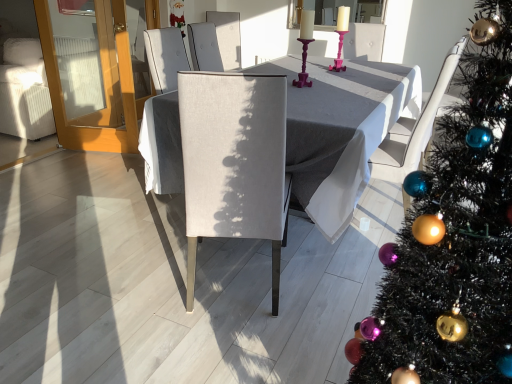
Question: Considering the relative sizes of white fabric armchair at right and shiny green christmas tree at right in the image provided, is white fabric armchair at right taller than shiny green christmas tree at right?

Choices:
 (A) yes
 (B) no

Answer: (B)

Question: Is white fabric armchair at right behind shiny green christmas tree at right?

Choices:
 (A) no
 (B) yes

Answer: (B)

Question: Considering the relative sizes of white fabric armchair at right and shiny green christmas tree at right in the image provided, is white fabric armchair at right bigger than shiny green christmas tree at right?

Choices:
 (A) yes
 (B) no

Answer: (B)

Question: From the image's perspective, is white fabric armchair at right below shiny green christmas tree at right?

Choices:
 (A) yes
 (B) no

Answer: (B)

Question: Is white fabric armchair at right facing away from shiny green christmas tree at right?

Choices:
 (A) no
 (B) yes

Answer: (A)

Question: From a real-world perspective, does white fabric armchair at right sit lower than shiny green christmas tree at right?

Choices:
 (A) no
 (B) yes

Answer: (B)

Question: Are pink plastic candle holder at center and white fabric armchair at right far apart?

Choices:
 (A) no
 (B) yes

Answer: (B)

Question: From a real-world perspective, is pink plastic candle holder at center located higher than white fabric armchair at right?

Choices:
 (A) yes
 (B) no

Answer: (A)

Question: From a real-world perspective, is pink plastic candle holder at center physically below white fabric armchair at right?

Choices:
 (A) yes
 (B) no

Answer: (B)

Question: Would you say pink plastic candle holder at center contains white fabric armchair at right?

Choices:
 (A) yes
 (B) no

Answer: (B)

Question: Considering the relative sizes of pink plastic candle holder at center and white fabric armchair at right in the image provided, is pink plastic candle holder at center wider than white fabric armchair at right?

Choices:
 (A) no
 (B) yes

Answer: (A)

Question: Is pink plastic candle holder at center closer to the viewer compared to white fabric armchair at right?

Choices:
 (A) no
 (B) yes

Answer: (A)

Question: Is the position of matte gray chair at center less distant than that of matte gray table at center?

Choices:
 (A) no
 (B) yes

Answer: (B)